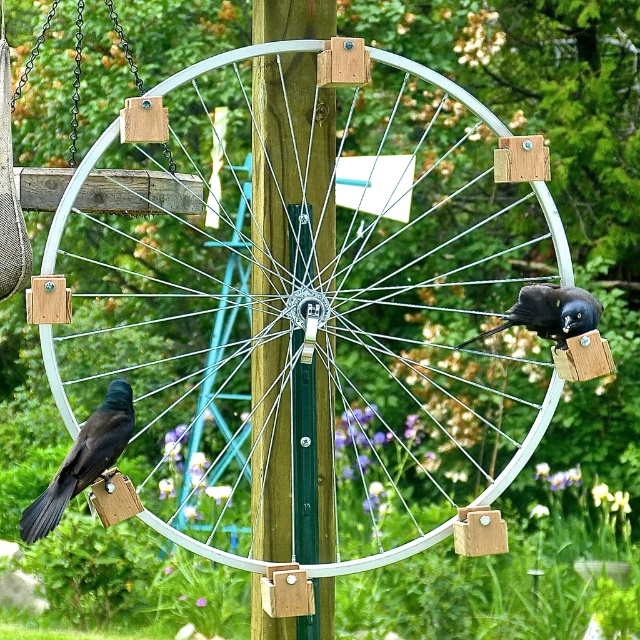
Question: Is shiny black bird at left smaller than shiny black bird at upper right?

Choices:
 (A) no
 (B) yes

Answer: (A)

Question: Which object appears farthest from the camera in this image?

Choices:
 (A) shiny black bird at upper right
 (B) green wood pole at center
 (C) shiny black bird at left

Answer: (A)

Question: Which point is closer to the camera?

Choices:
 (A) green wood pole at center
 (B) shiny black bird at left

Answer: (B)

Question: Can you confirm if white metallic wagon wheel at center is positioned above green wood pole at center?

Choices:
 (A) no
 (B) yes

Answer: (B)

Question: Which point appears closest to the camera in this image?

Choices:
 (A) (321, 259)
 (B) (301, 20)
 (C) (115, 432)
 (D) (557, 307)

Answer: (C)

Question: Does shiny black bird at left have a lesser width compared to shiny black bird at upper right?

Choices:
 (A) yes
 (B) no

Answer: (A)